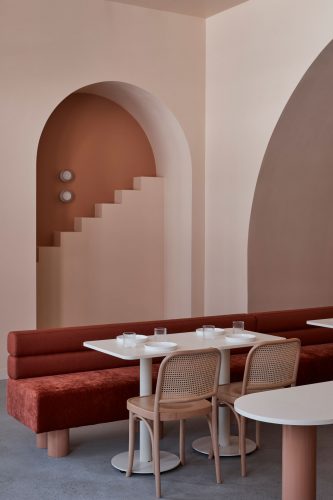
You are a GUI agent. You are given a task and a screenshot of the screen. Output one action in this format:
    pyautogui.click(x=<x>, y=<y>)
    Task: Click on the hall
    The width and height of the screenshot is (333, 500).
    Given the screenshot: What is the action you would take?
    pyautogui.click(x=176, y=125)